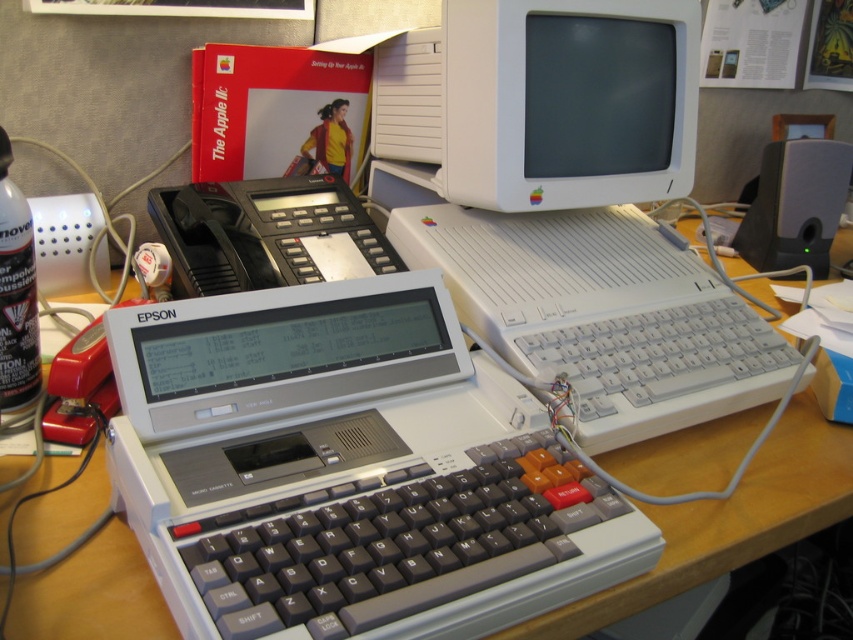
In the scene shown: You are setting up a desk and need to place both the white plastic monitor at upper center and the black plastic phone at center. Which object requires more desk space due to its size?

The white plastic monitor at upper center requires more desk space because it is larger in size compared to the black plastic phone at center.